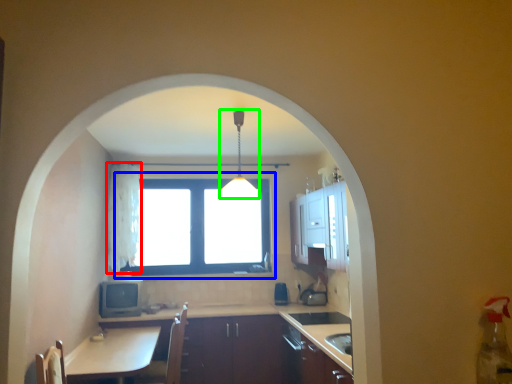
Question: Which is nearer to the curtain (highlighted by a red box)? window (highlighted by a blue box) or light fixture (highlighted by a green box).

Choices:
 (A) window
 (B) light fixture

Answer: (A)